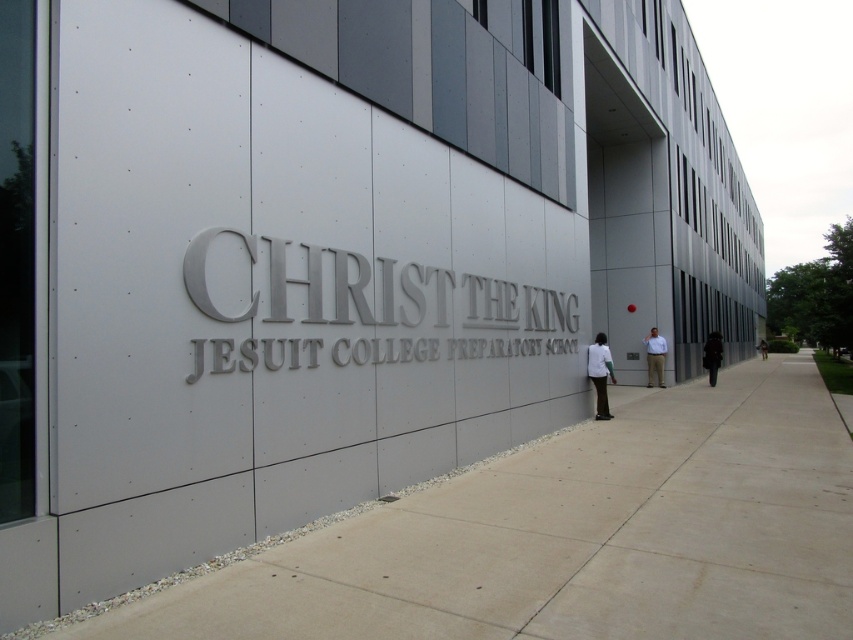
This screenshot has height=640, width=853. I want to click on light brown pants at right, so click(x=654, y=356).

Can you confirm if light brown pants at right is positioned above black fabric jacket at right?

Correct, light brown pants at right is located above black fabric jacket at right.

In order to click on light brown pants at right in this screenshot , I will do pyautogui.click(x=654, y=356).

Can you confirm if gray concrete pavement at center is positioned below black matte jacket at right?

Indeed, gray concrete pavement at center is positioned under black matte jacket at right.

Is gray concrete pavement at center in front of black matte jacket at right?

Yes, gray concrete pavement at center is closer to the viewer.

Does point (218, 579) come farther from viewer compared to point (711, 369)?

No, (218, 579) is closer to viewer.

Image resolution: width=853 pixels, height=640 pixels. In order to click on gray concrete pavement at center in this screenshot , I will do `click(564, 538)`.

Can you confirm if white matte shirt at center is positioned below black matte jacket at right?

Yes.

What do you see at coordinates (601, 372) in the screenshot? The height and width of the screenshot is (640, 853). I see `white matte shirt at center` at bounding box center [601, 372].

Locate an element on the screen. Image resolution: width=853 pixels, height=640 pixels. white matte shirt at center is located at coordinates (601, 372).